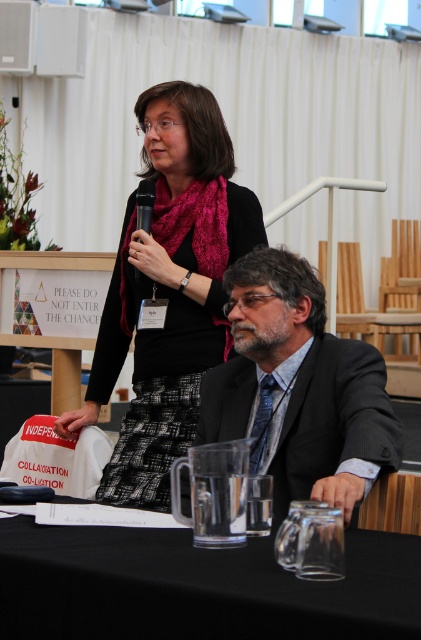
Question: Estimate the real-world distances between objects in this image. Which object is closer to the black glass table at lower center?

Choices:
 (A) matte black scarf at upper center
 (B) gray suit at center

Answer: (B)

Question: Does black glass table at lower center appear over black plastic microphone at upper center?

Choices:
 (A) no
 (B) yes

Answer: (A)

Question: Is gray suit at center closer to camera compared to black plastic microphone at upper center?

Choices:
 (A) no
 (B) yes

Answer: (B)

Question: Which of the following is the closest to the observer?

Choices:
 (A) (279, 468)
 (B) (120, 461)
 (C) (384, 563)

Answer: (C)

Question: Which of the following is the closest to the observer?

Choices:
 (A) tap(154, 202)
 (B) tap(154, 358)
 (C) tap(319, 378)
 (D) tap(372, 545)

Answer: (D)

Question: Can you confirm if matte black scarf at upper center is wider than gray suit at center?

Choices:
 (A) no
 (B) yes

Answer: (B)